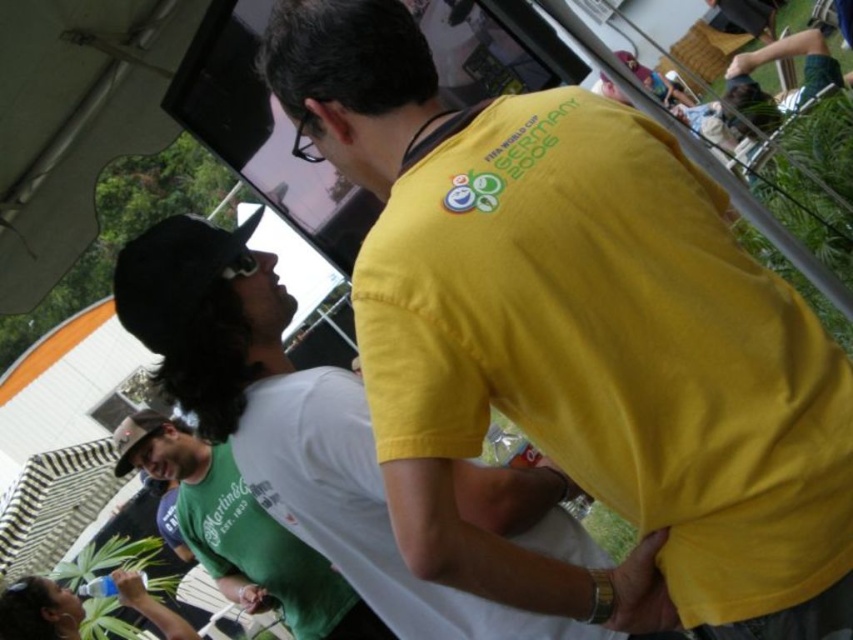
You are a photographer at this event and want to capture both the yellow cotton shirt at upper center and the yellow cotton shirt at center in a single frame. Which of the two shirts should you focus on to ensure both are in the frame without zooming in or out?

You should focus on the yellow cotton shirt at center because it is wider than the yellow cotton shirt at upper center, making it more likely to stay within the frame while capturing both.

You are standing in the crowd at this event and want to move from the position of point (x=595, y=243) to point (x=189, y=394). Since you can only move forward, will you have to walk towards or away from the camera to reach your destination?

Since point (x=595, y=243) is closer to the viewer than point (x=189, y=394), you will need to walk away from the camera to reach your destination.

You are at an outdoor event and see two people in the foreground. The first person is wearing a yellow cotton shirt at upper center, and the second person is wearing a green matte shirt at center. Which shirt is positioned higher in the image?

The yellow cotton shirt at upper center is positioned higher than the green matte shirt at center.